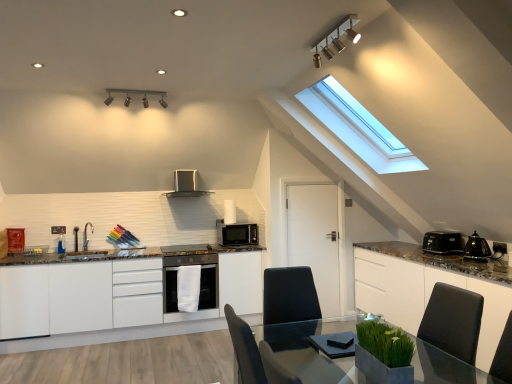
Question: Is white glossy cabinets at center, acting as the 1th cabinetry starting from the left, turned away from satin silver range hood at upper center, acting as the 2th kitchen appliance starting from the right?

Choices:
 (A) yes
 (B) no

Answer: (B)

Question: Is the depth of white glossy cabinets at center, placed as the 2th cabinetry when sorted from right to left, less than that of satin silver range hood at upper center, acting as the second kitchen appliance starting from the bottom?

Choices:
 (A) no
 (B) yes

Answer: (B)

Question: Can you confirm if white glossy cabinets at center, placed as the 2th cabinetry when sorted from right to left, is thinner than satin silver range hood at upper center, which is the 1th kitchen appliance from left to right?

Choices:
 (A) yes
 (B) no

Answer: (B)

Question: Is white glossy cabinets at center, placed as the 2th cabinetry when sorted from right to left, wider than satin silver range hood at upper center, acting as the 2th kitchen appliance starting from the right?

Choices:
 (A) yes
 (B) no

Answer: (A)

Question: Could you tell me if white glossy cabinets at center, placed as the 2th cabinetry when sorted from right to left, is facing satin silver range hood at upper center, which is the 1th kitchen appliance from left to right?

Choices:
 (A) no
 (B) yes

Answer: (A)

Question: Considering the positions of white glossy cabinets at center, placed as the 2th cabinetry when sorted from right to left, and matte black microwave at center, which is the 2th kitchen appliance from top to bottom, in the image, is white glossy cabinets at center, placed as the 2th cabinetry when sorted from right to left, wider or thinner than matte black microwave at center, which is the 2th kitchen appliance from top to bottom,?

Choices:
 (A) thin
 (B) wide

Answer: (B)

Question: Considering the relative positions of white glossy cabinets at center, acting as the 1th cabinetry starting from the left, and matte black microwave at center, acting as the 2th kitchen appliance starting from the left, in the image provided, is white glossy cabinets at center, acting as the 1th cabinetry starting from the left, to the left or to the right of matte black microwave at center, acting as the 2th kitchen appliance starting from the left,?

Choices:
 (A) right
 (B) left

Answer: (B)

Question: Is white glossy cabinets at center, placed as the 2th cabinetry when sorted from right to left, inside or outside of matte black microwave at center, acting as the 2th kitchen appliance starting from the left?

Choices:
 (A) outside
 (B) inside

Answer: (A)

Question: In terms of height, does white glossy cabinets at center, placed as the 2th cabinetry when sorted from right to left, look taller or shorter compared to matte black microwave at center, arranged as the first kitchen appliance when viewed from the right?

Choices:
 (A) short
 (B) tall

Answer: (B)

Question: Would you say clear glass table at center is inside or outside matte black microwave at center, arranged as the first kitchen appliance when viewed from the right?

Choices:
 (A) inside
 (B) outside

Answer: (B)

Question: Is clear glass table at center in front of or behind matte black microwave at center, arranged as the first kitchen appliance when viewed from the right, in the image?

Choices:
 (A) front
 (B) behind

Answer: (A)

Question: Considering the positions of clear glass table at center and matte black microwave at center, arranged as the first kitchen appliance when ordered from the bottom, in the image, is clear glass table at center taller or shorter than matte black microwave at center, arranged as the first kitchen appliance when ordered from the bottom,?

Choices:
 (A) short
 (B) tall

Answer: (B)

Question: Looking at the image, does clear glass table at center seem bigger or smaller compared to matte black microwave at center, arranged as the first kitchen appliance when ordered from the bottom?

Choices:
 (A) big
 (B) small

Answer: (A)

Question: In terms of width, does black plastic toaster at right, the 2th appliance in the front-to-back sequence, look wider or thinner when compared to white glossy cabinet at right, the 1th cabinetry in the right-to-left sequence?

Choices:
 (A) thin
 (B) wide

Answer: (A)

Question: Considering the relative positions of black plastic toaster at right, which is the 1th appliance from back to front, and white glossy cabinet at right, the 1th cabinetry in the right-to-left sequence, in the image provided, is black plastic toaster at right, which is the 1th appliance from back to front, to the left or to the right of white glossy cabinet at right, the 1th cabinetry in the right-to-left sequence,?

Choices:
 (A) right
 (B) left

Answer: (A)